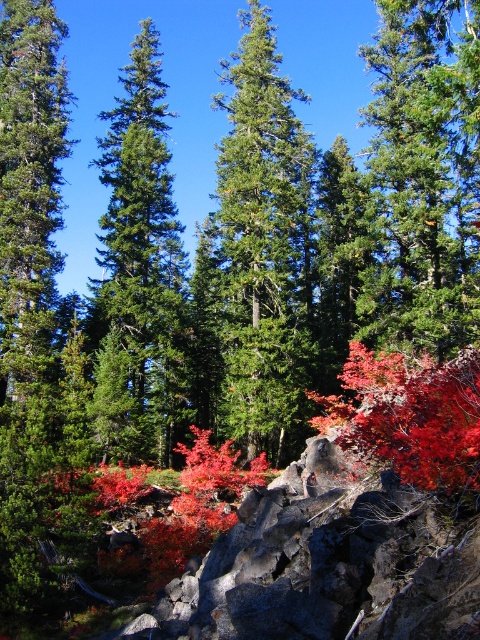
You are a hiker who wants to place a 5 meter long tent between the green matte evergreen tree at center and the green glossy pine tree at center. Can you fit the tent between them without moving either tree?

The distance between the green matte evergreen tree at center and the green glossy pine tree at center is 5.70 meters. Since the tent is 5 meters long, there is enough space to fit it between them as the distance is greater than the tent length.